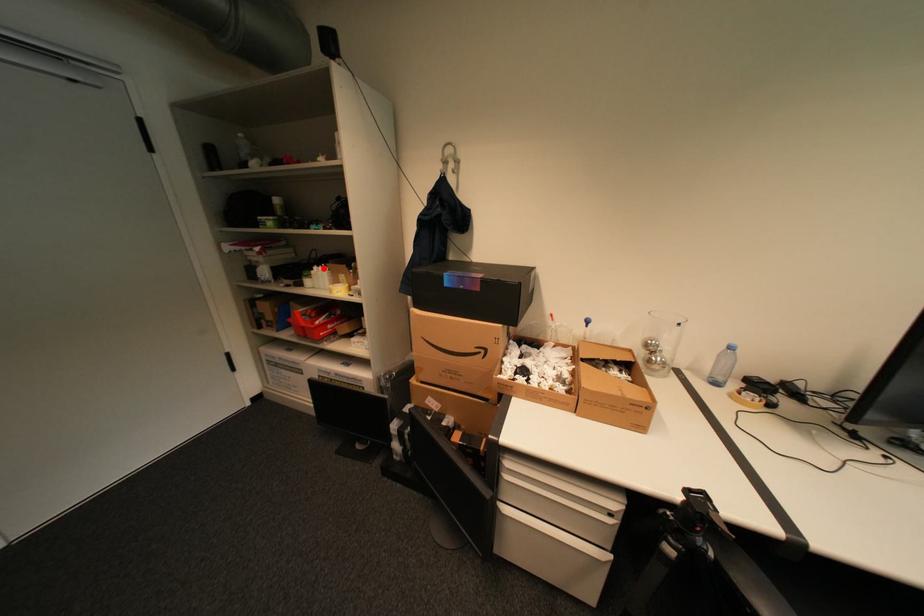
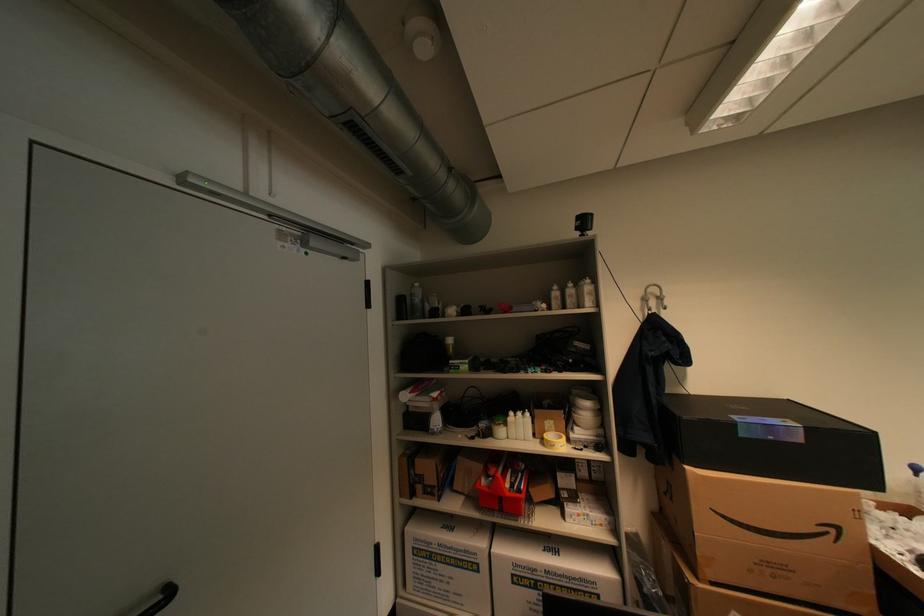
Locate, in the second image, the point that corresponds to the highlighted location in the first image.

(519, 414)